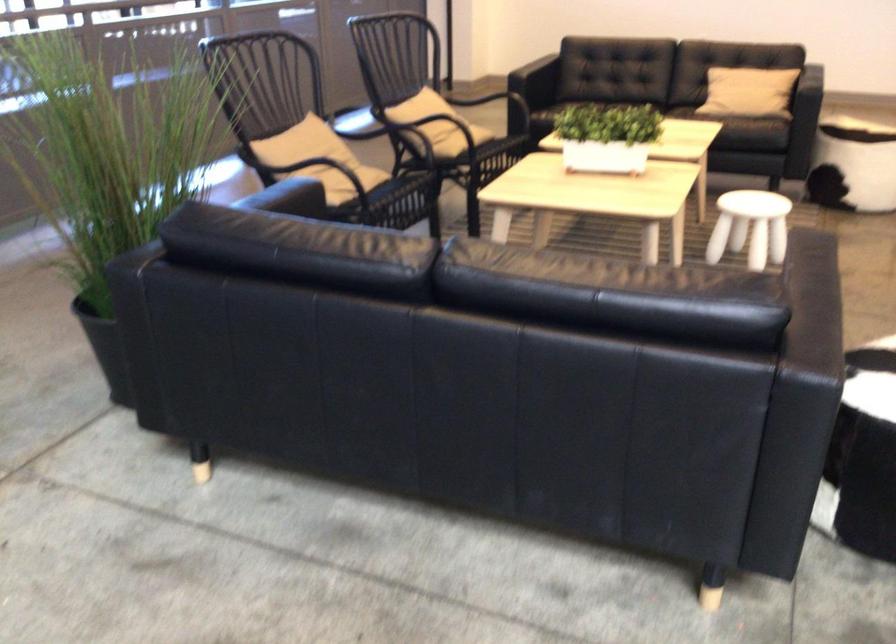
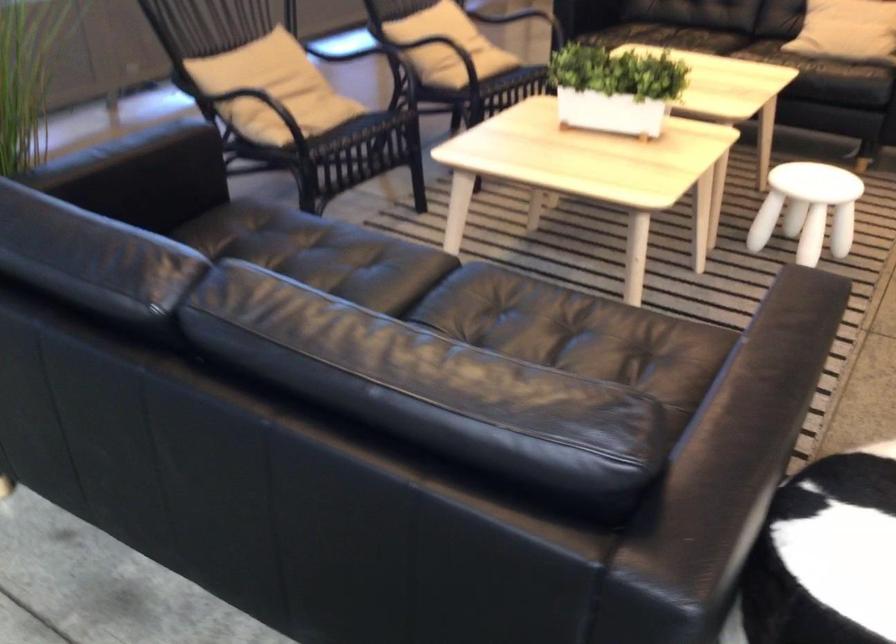
In the second image, find the point that corresponds to (433,118) in the first image.

(433, 43)